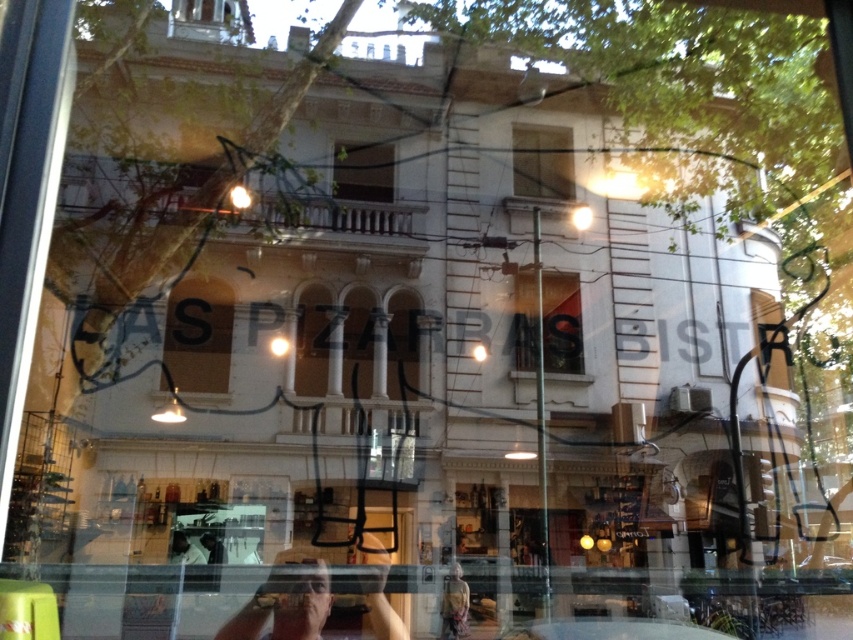
You are standing inside a building and looking through the clear glass window at upper center and the clear glass window at center. Which window is closer to you?

The clear glass window at upper center is closer to you because the clear glass window at center is behind it.

You are standing inside a building and looking through a window at another building across the street. Your phone is placed at point [286,602]. The reflection of your face is visible in the bottom center of the window. Can you see your phone reflected in the window?

The point [286,602] corresponds to the matte black phone at center, which is where your phone is placed. Since the reflection of your face is visible in the bottom center, it suggests that the window reflects objects positioned in front of it. However, the phone is placed at the center, which may not be in the same area as the bottom center reflection. Therefore, whether the phone is reflected depends on its position relative to the reflective area of the window. Since the description only mentions the 0